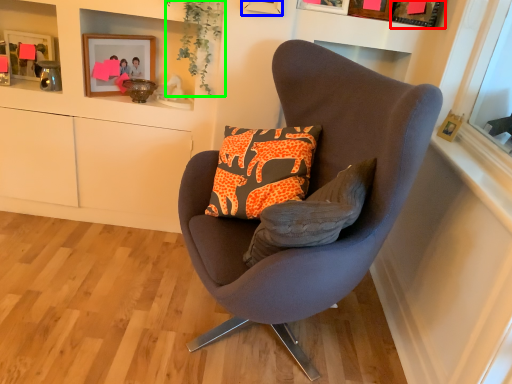
Question: Which is nearer to the picture frame (highlighted by a red box)? picture frame (highlighted by a blue box) or plant (highlighted by a green box).

Choices:
 (A) picture frame
 (B) plant

Answer: (A)